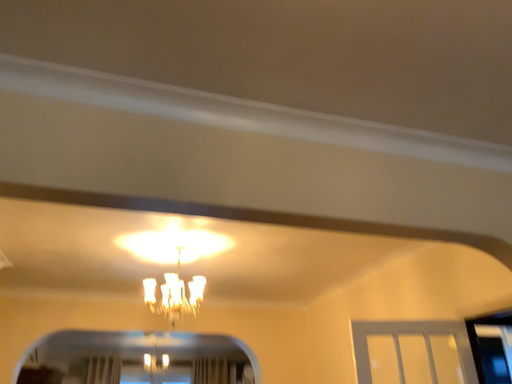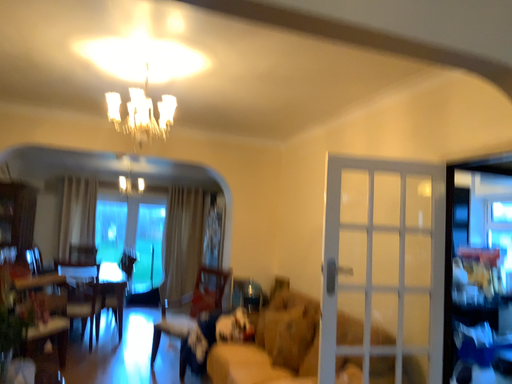
Question: How did the camera likely rotate when shooting the video?

Choices:
 (A) rotated upward
 (B) rotated downward

Answer: (B)